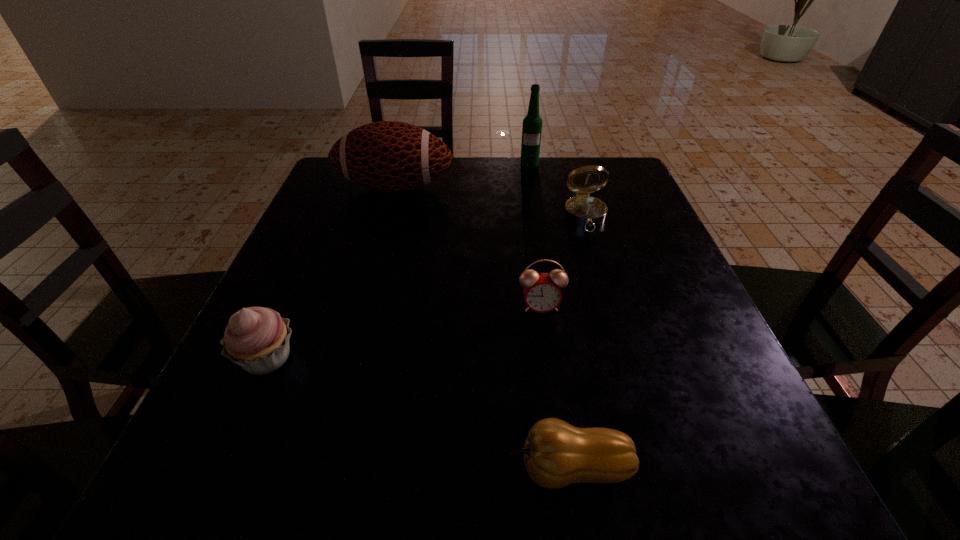
The height and width of the screenshot is (540, 960). I want to click on unoccupied area between the alarm clock and the compass, so click(563, 261).

Choose which object is the third nearest neighbor to the fifth shortest object. Please provide its 2D coordinates. Your answer should be formatted as a tuple, i.e. [(x, y)], where the tuple contains the x and y coordinates of a point satisfying the conditions above.

[(542, 293)]

Locate an element on the screen. the closest object to the cupcake is located at coordinates (556, 454).

Find the location of a particular element. This screenshot has width=960, height=540. free location that satisfies the following two spatial constraints: 1. on the back side of the cupcake; 2. on the right side of the fifth shortest object is located at coordinates [343, 187].